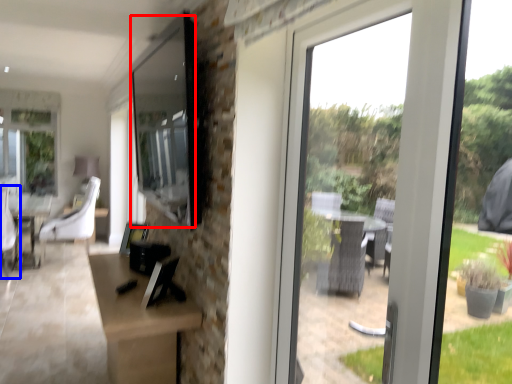
Question: Among these objects, which one is farthest to the camera, window screen (highlighted by a red box) or swivel chair (highlighted by a blue box)?

Choices:
 (A) window screen
 (B) swivel chair

Answer: (B)